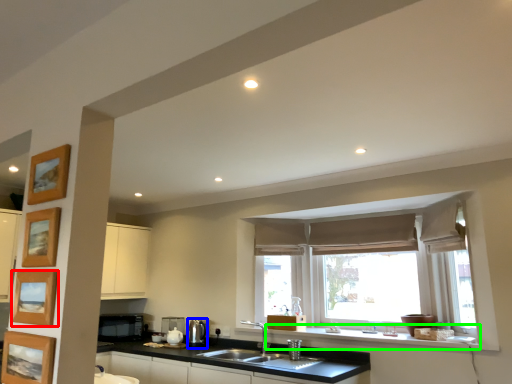
Question: Which is farther away from picture frame (highlighted by a red box)? appliance (highlighted by a blue box) or window sill (highlighted by a green box)?

Choices:
 (A) appliance
 (B) window sill

Answer: (A)